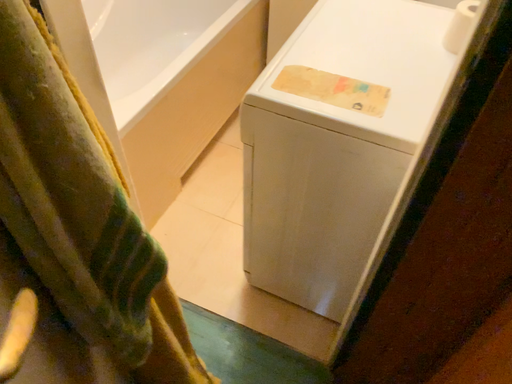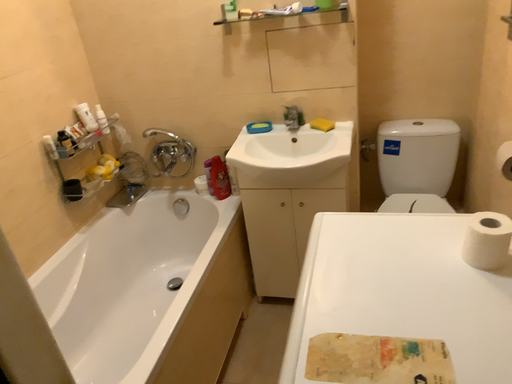
Question: How did the camera likely rotate when shooting the video?

Choices:
 (A) rotated downward
 (B) rotated upward

Answer: (B)